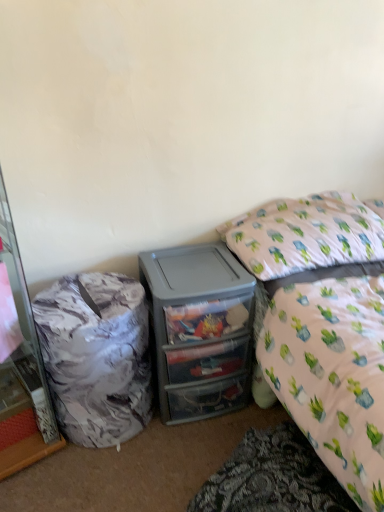
Question: From a real-world perspective, is translucent plastic drawers at center physically located above or below white fabric pillow at upper right?

Choices:
 (A) above
 (B) below

Answer: (B)

Question: From their relative heights in the image, would you say translucent plastic drawers at center is taller or shorter than white fabric pillow at upper right?

Choices:
 (A) tall
 (B) short

Answer: (A)

Question: Estimate the real-world distances between objects in this image. Which object is farther from the translucent plastic drawers at center?

Choices:
 (A) marble-patterned cabinet at left
 (B) white fabric pillow at upper right
 (C) marble-patterned trash can at left

Answer: (A)

Question: Which is nearer to the marble-patterned cabinet at left?

Choices:
 (A) white fabric pillow at upper right
 (B) translucent plastic drawers at center
 (C) marble-patterned trash can at left

Answer: (C)